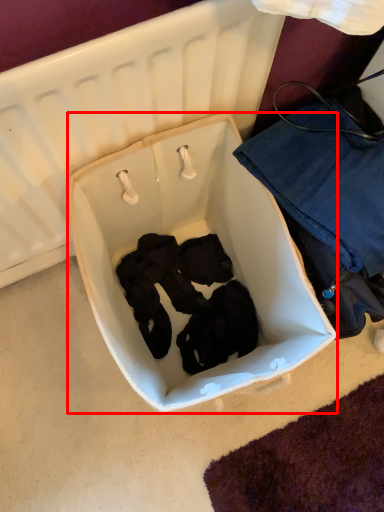
Question: From the image's perspective, considering the relative positions of infant bed (annotated by the red box) and clothing in the image provided, where is infant bed (annotated by the red box) located with respect to the staircase?

Choices:
 (A) above
 (B) below

Answer: (B)